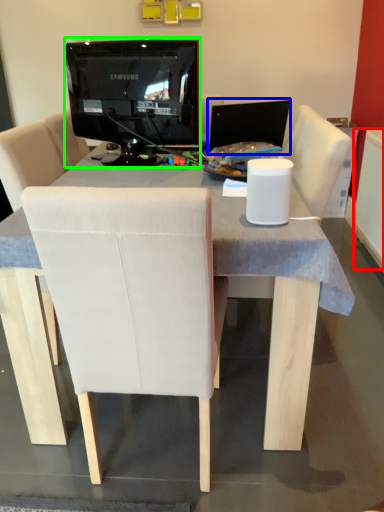
Question: Which object is the closest to the radiator (highlighted by a red box)? Choose among these: computer monitor (highlighted by a blue box) or television (highlighted by a green box).

Choices:
 (A) computer monitor
 (B) television

Answer: (A)